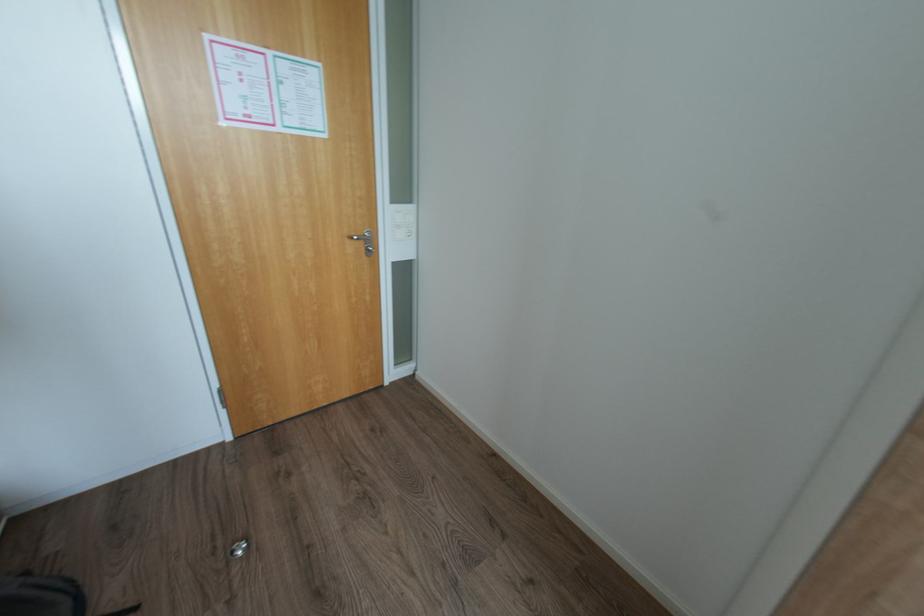
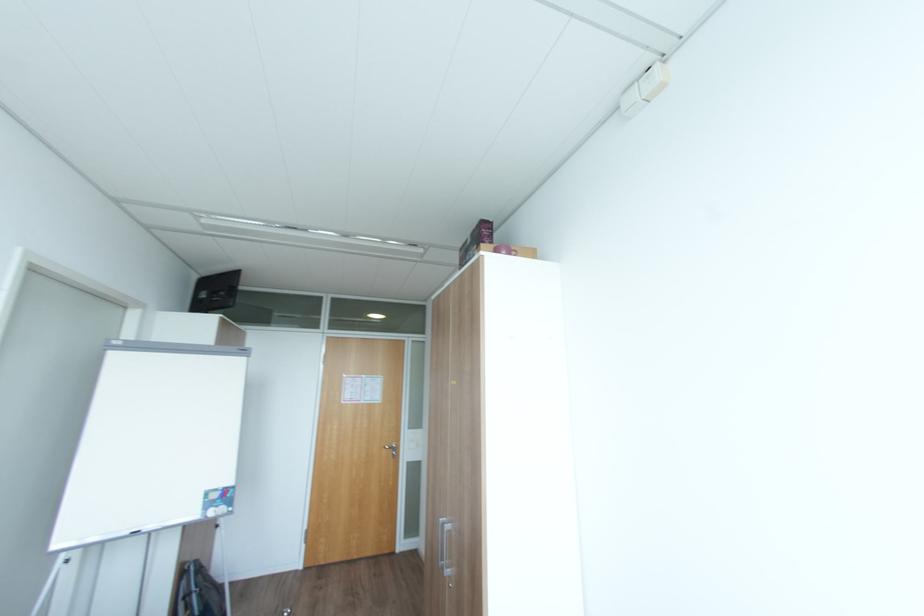
Where in the second image is the point corresponding to (x=360, y=237) from the first image?

(392, 448)